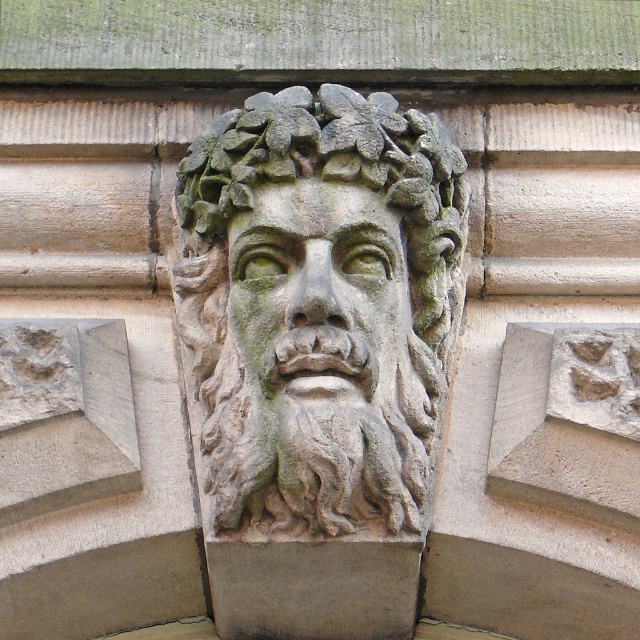
You are an architect examining a stone carving on a building facade. You notice two points labeled as point [406,280] and point [300,262]. Which point is closer to you?

Point [406,280] is further to the viewer than point [300,262], so point [300,262] is closer to you.

You are a tour guide standing 120 feet away from a building. You want to show visitors the green mossy stone face at center carved into the facade. Can you clearly point it out to them from your current position?

The green mossy stone face at center is 119.68 feet away from the viewer. Since you are standing 120 feet away, you are just slightly farther than the distance to the stone face. However, the difference of 0.32 feet is negligible, so you can still clearly point it out to the visitors from your current position.